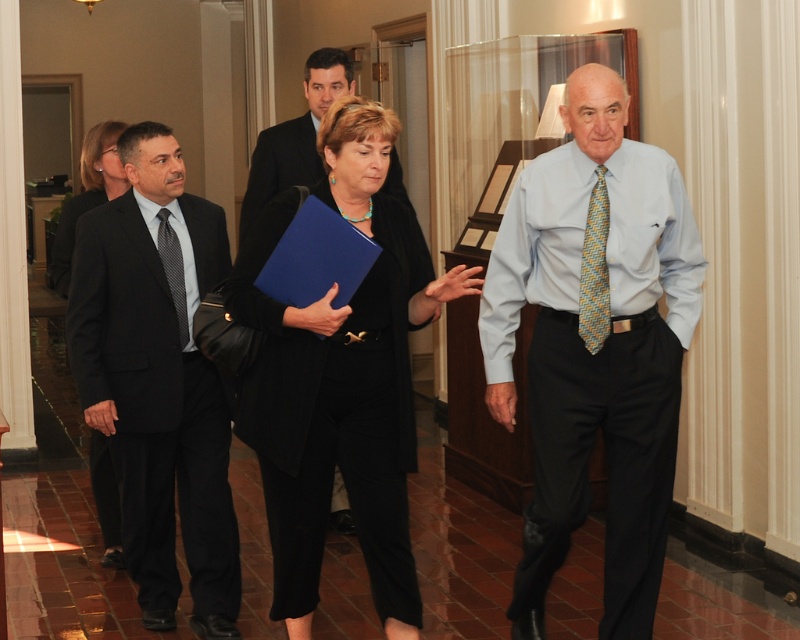
Question: Is black fabric suit at left bigger than yellow-green woven tie at center-right?

Choices:
 (A) no
 (B) yes

Answer: (B)

Question: Does black matte blazer at center appear on the right side of black fabric suit at left?

Choices:
 (A) no
 (B) yes

Answer: (B)

Question: Which is farther from the yellow-green woven tie at center-right?

Choices:
 (A) matte black suit at left
 (B) black textured tie at left
 (C) black matte blazer at center
 (D) black fabric suit at left

Answer: (D)

Question: Which of the following is the closest to the observer?

Choices:
 (A) (474, 280)
 (B) (588, 209)

Answer: (A)

Question: Can you confirm if black matte blazer at center is thinner than yellow-green woven tie at center-right?

Choices:
 (A) yes
 (B) no

Answer: (B)

Question: Considering the real-world distances, which object is closest to the yellow-green woven tie at center-right?

Choices:
 (A) matte black suit at left
 (B) black matte blazer at center
 (C) black textured tie at left
 (D) black fabric suit at left

Answer: (B)